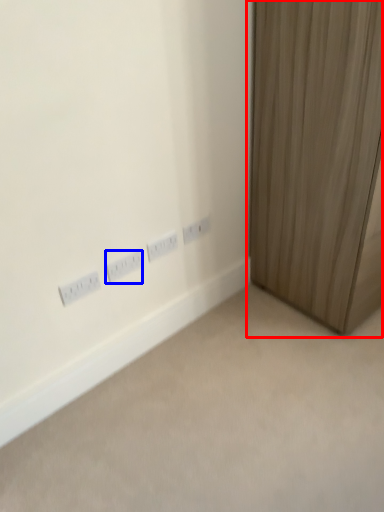
Question: Which of the following is the closest to the observer, curtain (highlighted by a red box) or power plugs and sockets (highlighted by a blue box)?

Choices:
 (A) curtain
 (B) power plugs and sockets

Answer: (A)